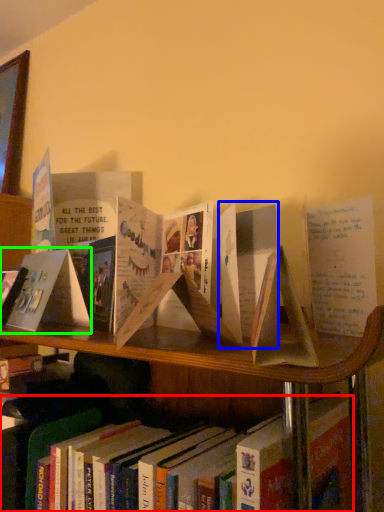
Question: Which object is the farthest from book (highlighted by a red box)? Choose among these: paperback book (highlighted by a blue box) or paperback book (highlighted by a green box).

Choices:
 (A) paperback book
 (B) paperback book

Answer: (B)